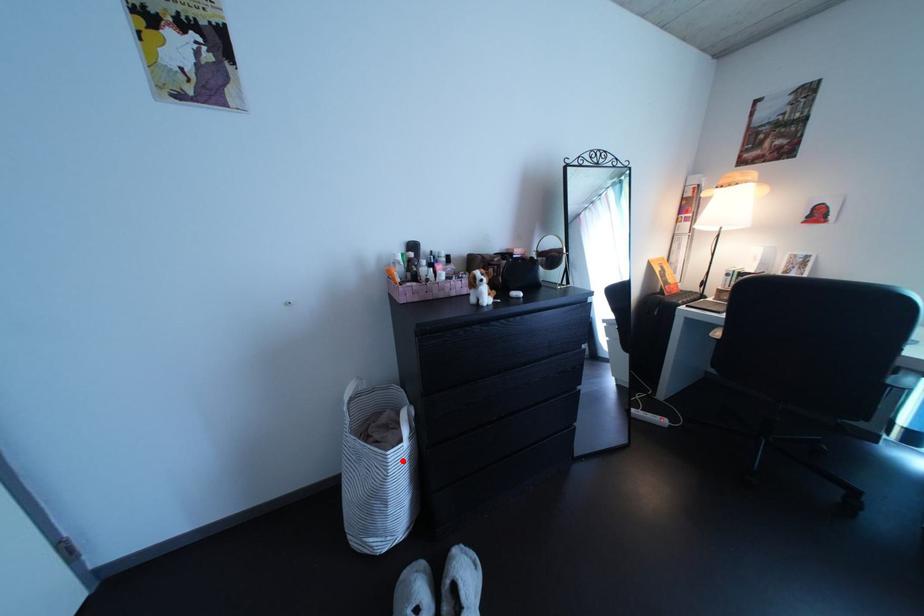
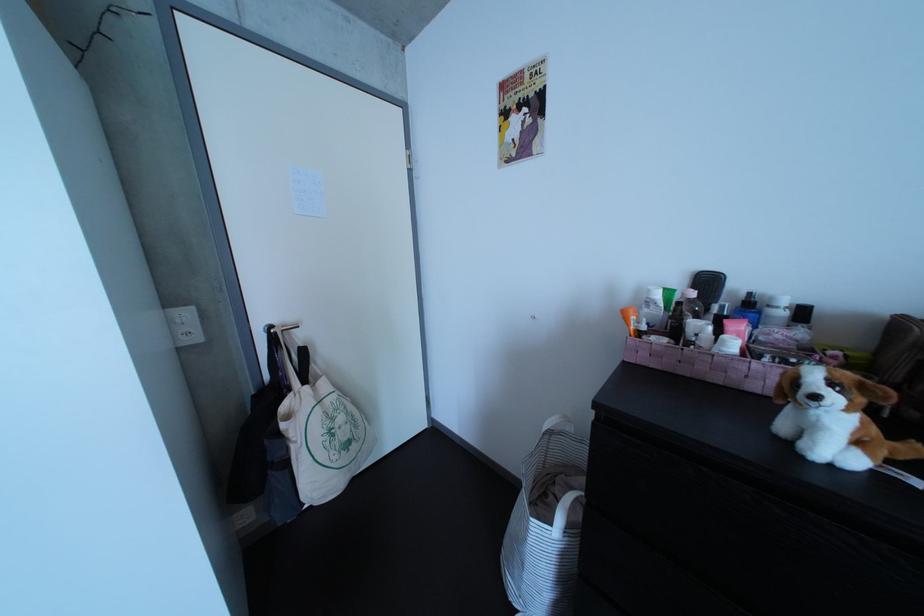
Find the pixel in the second image that matches the highlighted location in the first image.

(545, 527)